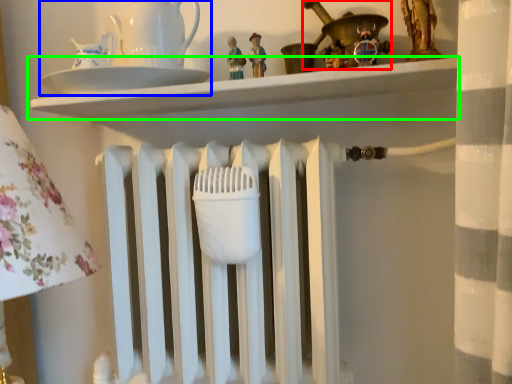
Question: Which is nearer to the toy (highlighted by a red box)? tea set (highlighted by a blue box) or shelf (highlighted by a green box).

Choices:
 (A) tea set
 (B) shelf

Answer: (B)